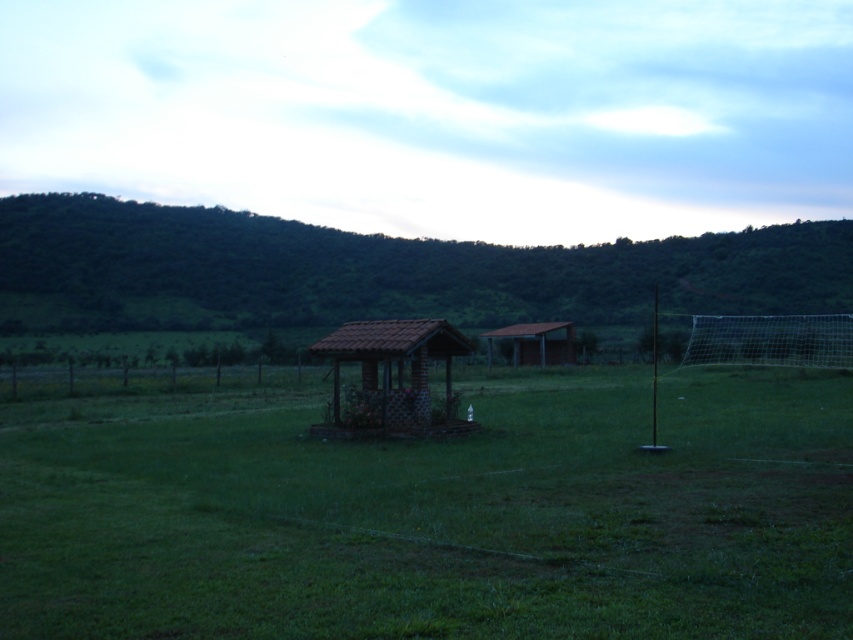
Does green grassy field at center have a lesser height compared to green grassy hillside at upper center?

Correct, green grassy field at center is not as tall as green grassy hillside at upper center.

Where is `green grassy field at center`? green grassy field at center is located at coordinates (434, 512).

Between point (1, 616) and point (254, 300), which one is positioned in front?

Point (1, 616) is in front.

Locate an element on the screen. Image resolution: width=853 pixels, height=640 pixels. green grassy field at center is located at coordinates (434, 512).

Which is more to the right, green grassy field at center or brick/tiled hut at center?

From the viewer's perspective, green grassy field at center appears more on the right side.

Does green grassy field at center have a greater width compared to brick/tiled hut at center?

Yes.

This screenshot has width=853, height=640. What are the coordinates of `green grassy field at center` in the screenshot? It's located at (434, 512).

The image size is (853, 640). I want to click on green grassy field at center, so click(x=434, y=512).

Who is more distant from viewer, (22, 467) or (503, 326)?

Point (503, 326)

Can you confirm if green grassy field at center is bigger than brown corrugated metal hut at center?

Correct, green grassy field at center is larger in size than brown corrugated metal hut at center.

Which is behind, point (547, 465) or point (520, 353)?

The point (520, 353) is more distant.

You are a GUI agent. You are given a task and a screenshot of the screen. Output one action in this format:
    pyautogui.click(x=<x>, y=<y>)
    Task: Click on the green grassy field at center
    This screenshot has width=853, height=640.
    Given the screenshot: What is the action you would take?
    pyautogui.click(x=434, y=512)